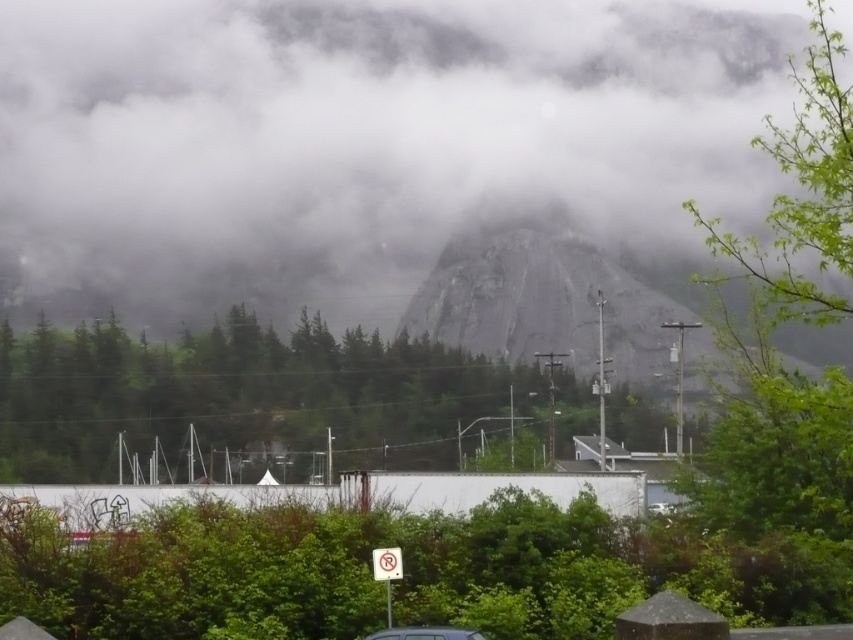
You are standing in the misty mountain area and see both the green leafy tree at center and the metallic silver car at lower center. Which object is bigger in size?

The green leafy tree at center is larger in size compared to the metallic silver car at lower center.

You are a photographer trying to capture the metallic silver car at lower center and the green leafy tree at center in the same frame. Which object will occupy more horizontal space in your photo?

The green leafy tree at center is wider than the metallic silver car at lower center, so it will occupy more horizontal space in the photo.